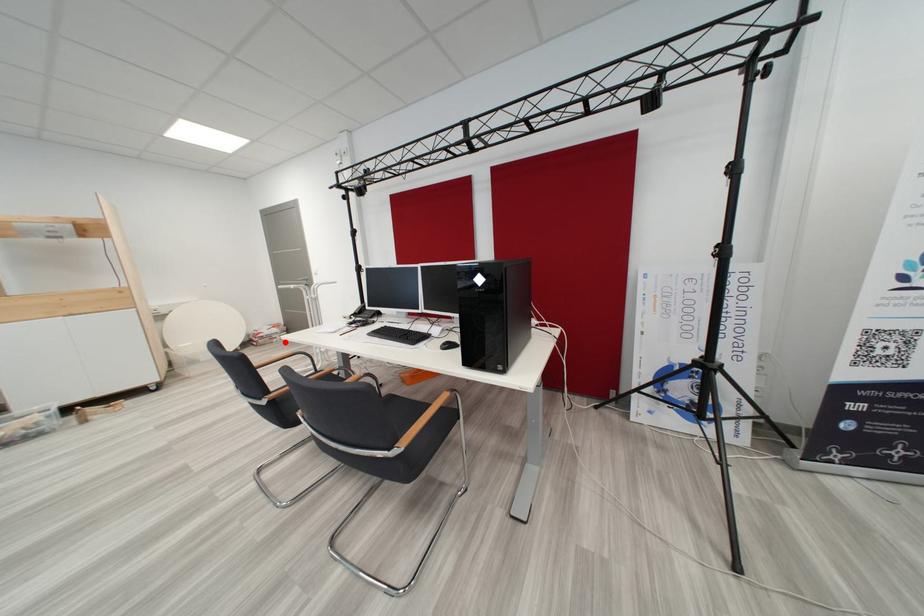
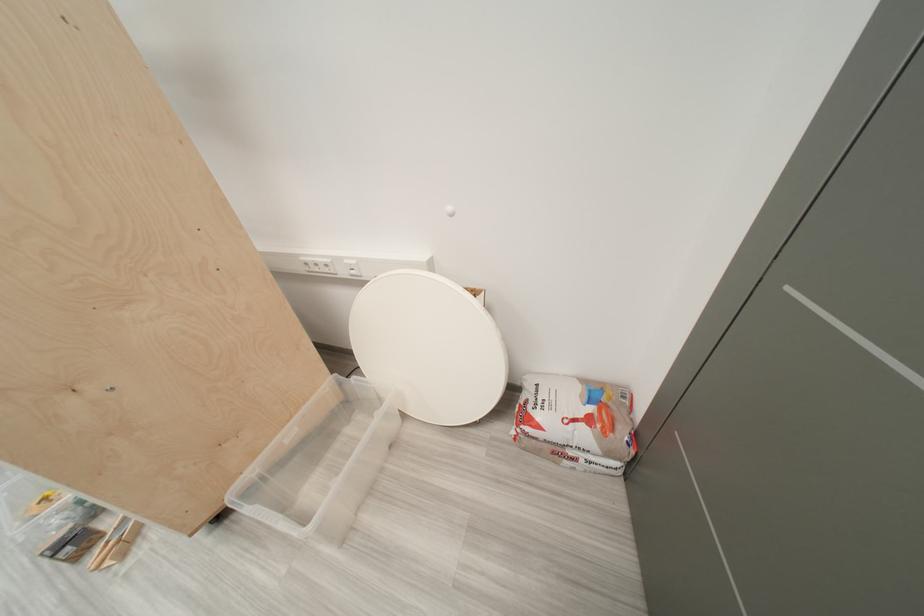
Question: I am providing you with two images of the same scene from different viewpoints. In image1, a red point is highlighted. Considering the same 3D point in image2, which of the following is correct?

Choices:
 (A) It is closer
 (B) It is farther

Answer: (A)